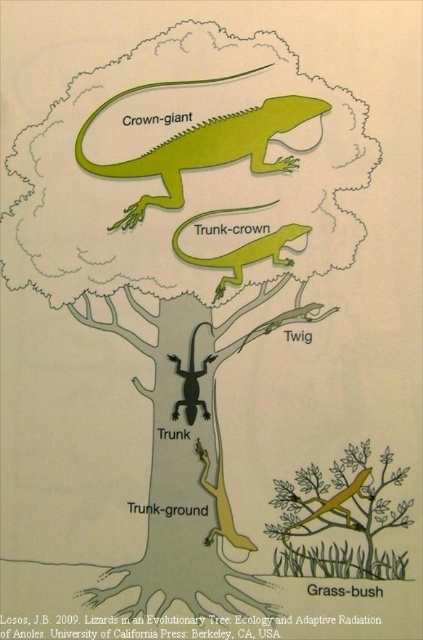
This screenshot has width=423, height=640. Find the location of `green matte lizard at trunk-crown`. green matte lizard at trunk-crown is located at coordinates (241, 248).

Which is more to the left, green matte lizard at trunk-crown or yellow matte lizard at trunk-ground?

yellow matte lizard at trunk-ground is more to the left.

Who is more forward, [264,205] or [231,520]?

Point [231,520]

Find the location of a particular element. This screenshot has width=423, height=640. green matte lizard at trunk-crown is located at coordinates (241, 248).

Can you confirm if green matte lizard at upper center is positioned to the left of black matte lizard at trunk?

In fact, green matte lizard at upper center is to the right of black matte lizard at trunk.

Is green matte lizard at upper center to the right of black matte lizard at trunk from the viewer's perspective?

Yes, green matte lizard at upper center is to the right of black matte lizard at trunk.

The height and width of the screenshot is (640, 423). Describe the element at coordinates (203, 145) in the screenshot. I see `green matte lizard at upper center` at that location.

Identify the location of green matte lizard at upper center. (203, 145).

Looking at this image, can you confirm if green matte lizard at upper center is smaller than green matte lizard at trunk-crown?

Incorrect, green matte lizard at upper center is not smaller in size than green matte lizard at trunk-crown.

Does green matte lizard at upper center lie in front of green matte lizard at trunk-crown?

No, it is not.

Who is more forward, (293, 161) or (261, 259)?

Point (261, 259) is more forward.

Locate an element on the screen. Image resolution: width=423 pixels, height=640 pixels. green matte lizard at upper center is located at coordinates (203, 145).